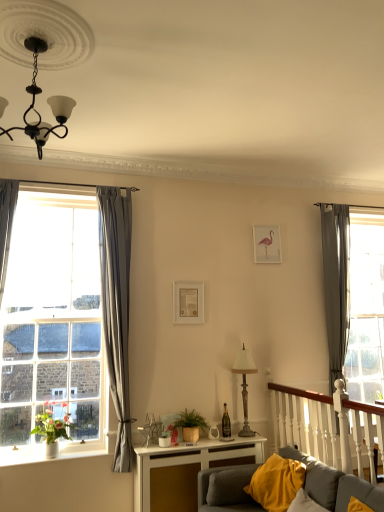
Question: Considering the positions of metallic lampshade at center-right and yellow fabric pillow at lower right in the image, is metallic lampshade at center-right wider or thinner than yellow fabric pillow at lower right?

Choices:
 (A) wide
 (B) thin

Answer: (B)

Question: From the image's perspective, is metallic lampshade at center-right located above or below yellow fabric pillow at lower right?

Choices:
 (A) above
 (B) below

Answer: (A)

Question: Which object is positioned farthest from the gray fabric curtain at left, the second curtain in the back-to-front sequence?

Choices:
 (A) green woven basket at center
 (B) clear glass window at left
 (C) pink paper picture frame at upper center, the 1th picture frame when ordered from right to left
 (D) black matte chandelier at upper left
 (E) green matte plant at left

Answer: (D)

Question: Considering the real-world distances, which object is closest to the white glossy table at lower center?

Choices:
 (A) white ceramic vase at lower left
 (B) gray fabric curtain at right, which is the second curtain in left-to-right order
 (C) clear glass window at left
 (D) transparent glass door at right
 (E) pink paper picture frame at upper center, which is counted as the second picture frame, starting from the bottom

Answer: (A)